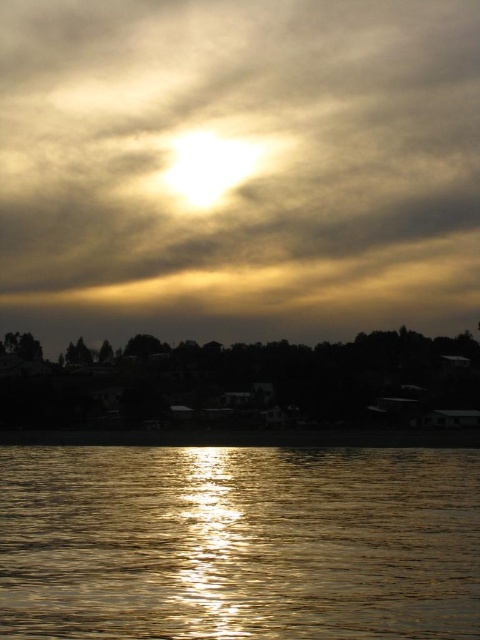
Question: Is glistening reflective water at lower center bigger than dark matte trees at lower center?

Choices:
 (A) yes
 (B) no

Answer: (B)

Question: Which object is farther from the camera taking this photo?

Choices:
 (A) glistening reflective water at lower center
 (B) golden translucent cloud at upper center

Answer: (B)

Question: Is golden translucent cloud at upper center positioned in front of dark matte trees at lower center?

Choices:
 (A) no
 (B) yes

Answer: (A)

Question: Which point is closer to the camera?

Choices:
 (A) (191, 376)
 (B) (28, 483)
 (C) (51, 337)

Answer: (B)

Question: Which object is farther from the camera taking this photo?

Choices:
 (A) glistening reflective water at lower center
 (B) dark matte trees at lower center

Answer: (B)

Question: Can you confirm if golden translucent cloud at upper center is positioned to the left of dark matte trees at lower center?

Choices:
 (A) no
 (B) yes

Answer: (A)